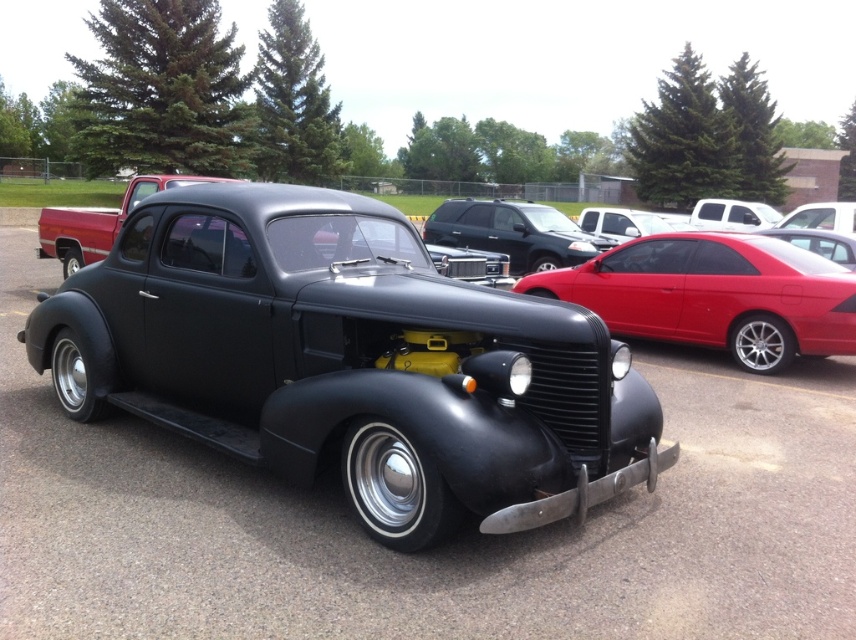
Does point (730, 552) come farther from viewer compared to point (524, 260)?

That is False.

Who is lower down, matte black car at center or matte black suv at center?

matte black car at center is lower down.

What do you see at coordinates (435, 548) in the screenshot?
I see `matte black car at center` at bounding box center [435, 548].

This screenshot has width=856, height=640. What are the coordinates of `matte black car at center` in the screenshot? It's located at (435, 548).